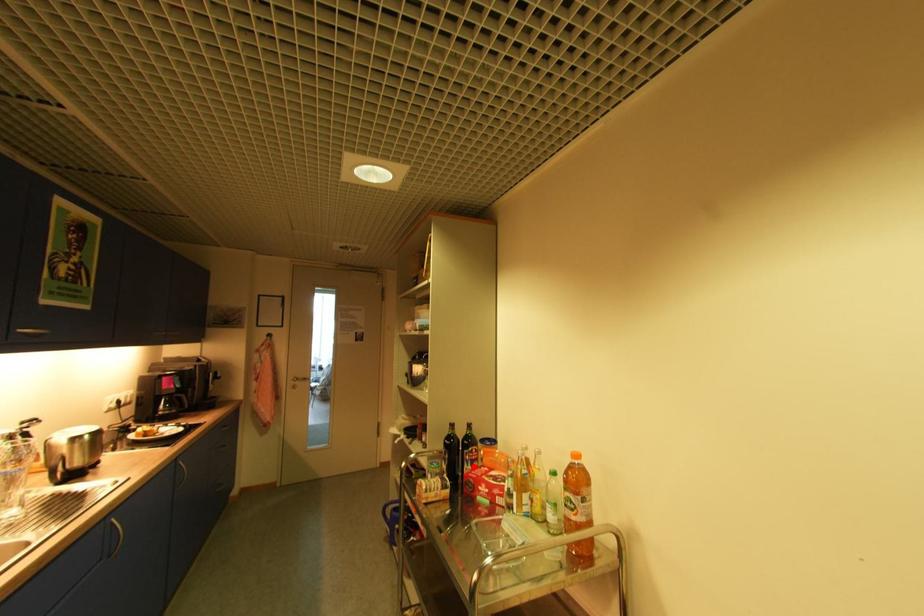
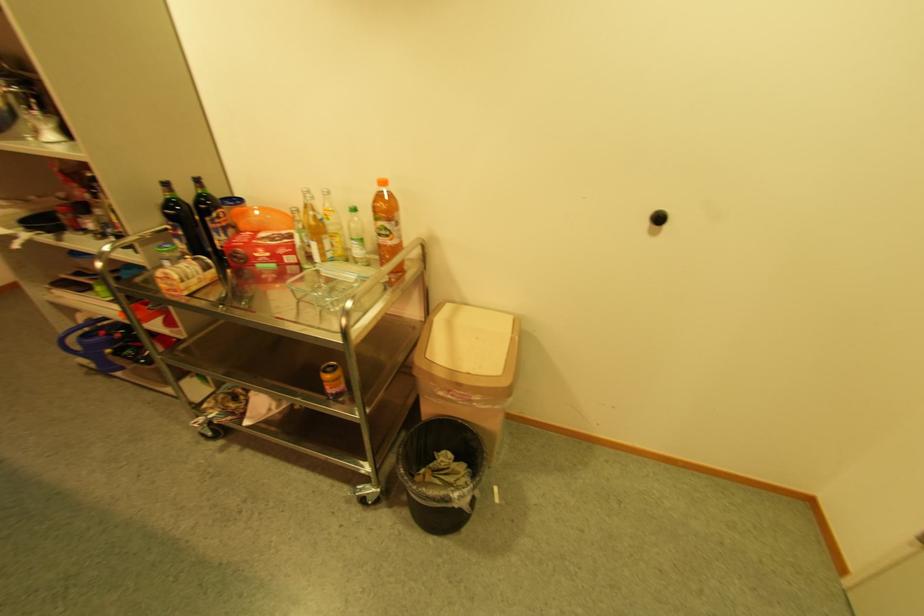
Locate, in the second image, the point that corresponds to the highlighted location in the first image.

(225, 237)